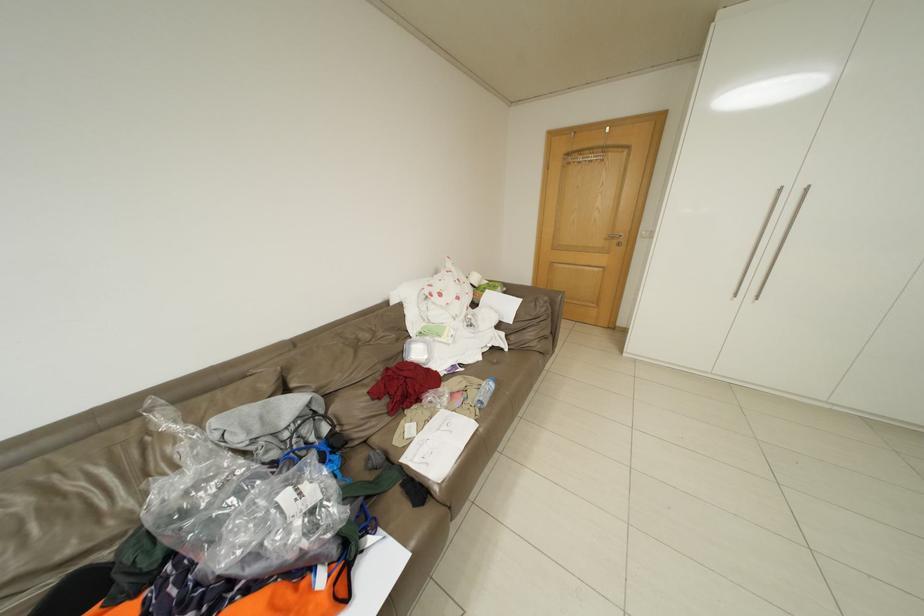
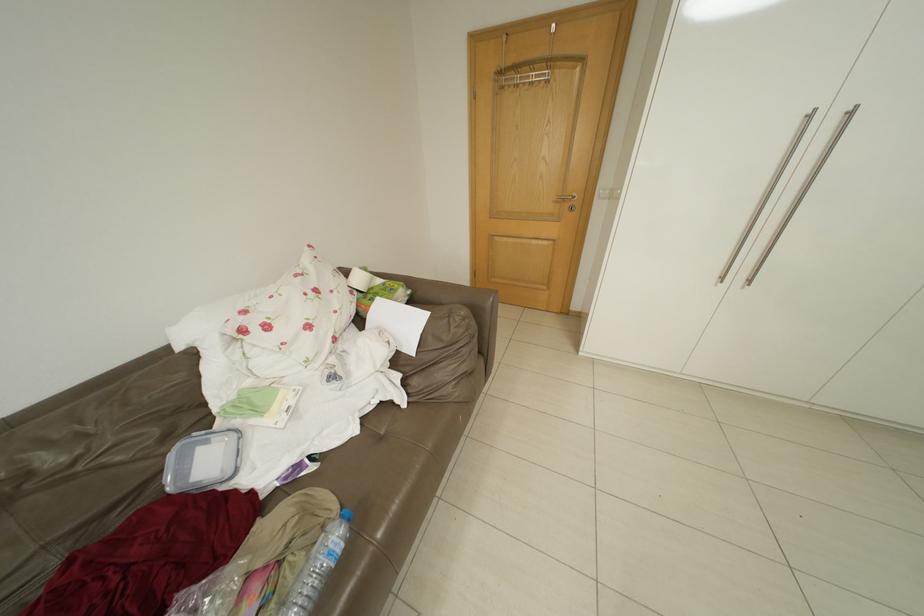
Question: The images are taken continuously from a first-person perspective. In which direction is your viewpoint rotating?

Choices:
 (A) Left
 (B) Right
 (C) Up
 (D) Down

Answer: (B)